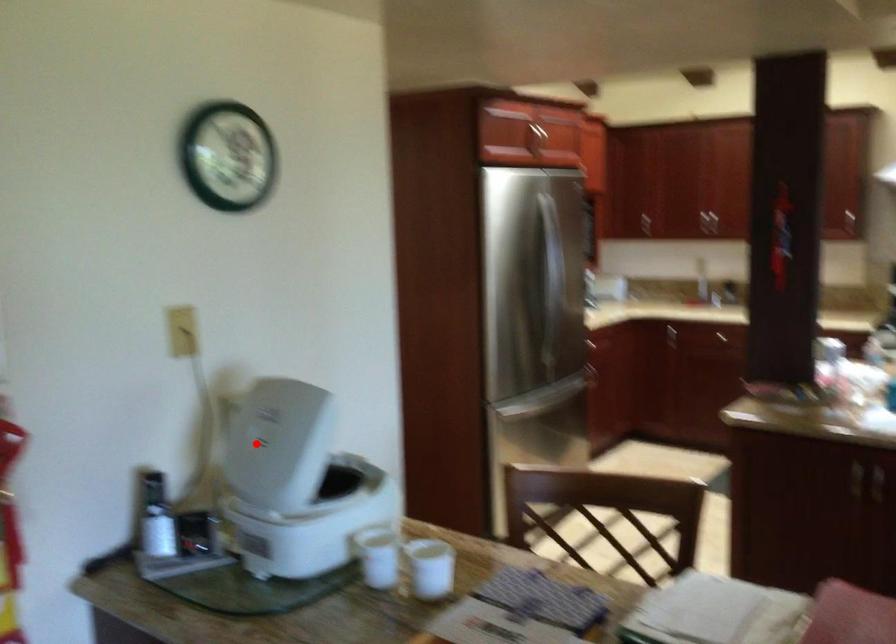
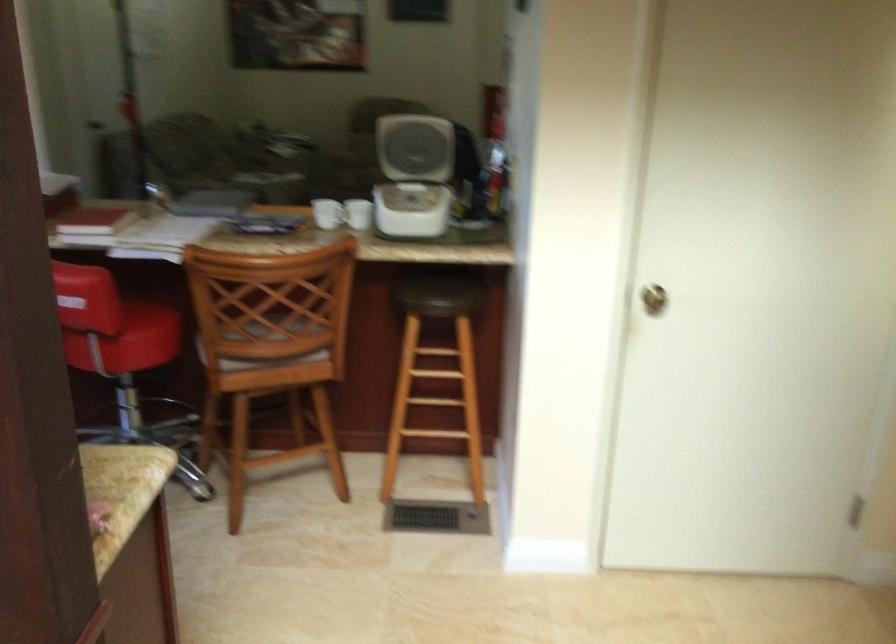
Question: I am providing you with two images of the same scene from different viewpoints. In image1, a red point is highlighted. Considering the same 3D point in image2, which of the following is correct?

Choices:
 (A) It is closer
 (B) It is farther

Answer: (B)